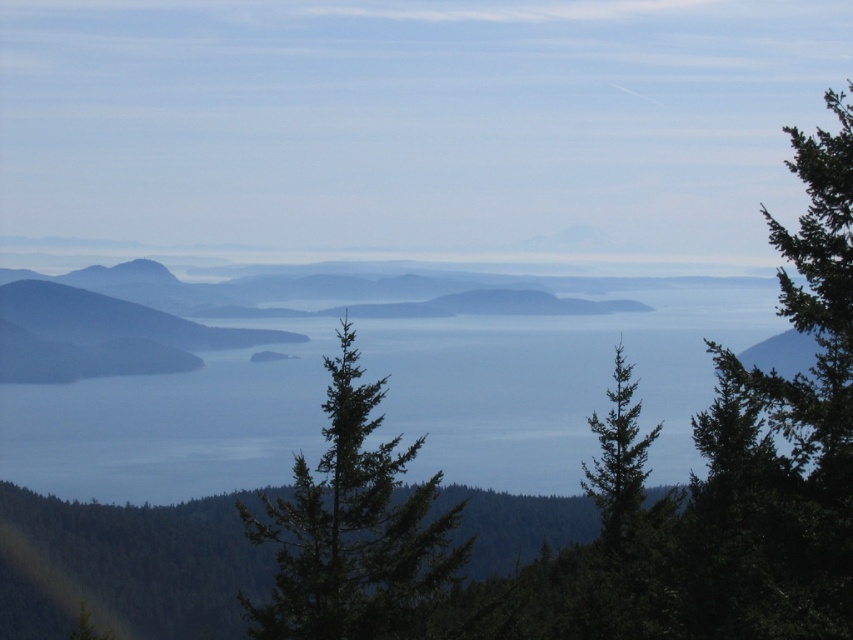
Does blue water at center appear under green textured tree at center?

Yes.

Which is above, blue water at center or green textured tree at center?

green textured tree at center

Is point (270, 436) less distant than point (611, 512)?

No, it is not.

You are a GUI agent. You are given a task and a screenshot of the screen. Output one action in this format:
    pyautogui.click(x=<x>, y=<y>)
    Task: Click on the blue water at center
    Image resolution: width=853 pixels, height=640 pixels.
    Given the screenshot: What is the action you would take?
    pyautogui.click(x=560, y=384)

At what (x,y) coordinates should I click in order to perform the action: click on blue water at center. Please return your answer as a coordinate pair (x, y). The image size is (853, 640). Looking at the image, I should click on (560, 384).

Can you confirm if blue water at center is positioned to the right of green needle-like tree at center?

In fact, blue water at center is to the left of green needle-like tree at center.

Does point (285, 390) come behind point (380, 472)?

That is True.

Find the location of a particular element. The image size is (853, 640). blue water at center is located at coordinates (560, 384).

Looking at this image, can you confirm if green needle-like tree at center is taller than green textured tree at center?

Incorrect, green needle-like tree at center's height is not larger of green textured tree at center's.

Based on the photo, does green needle-like tree at center appear on the left side of green textured tree at center?

Correct, you'll find green needle-like tree at center to the left of green textured tree at center.

Find the location of `green needle-like tree at center`. green needle-like tree at center is located at coordinates (352, 529).

Where is `green needle-like tree at center`? This screenshot has height=640, width=853. green needle-like tree at center is located at coordinates (352, 529).